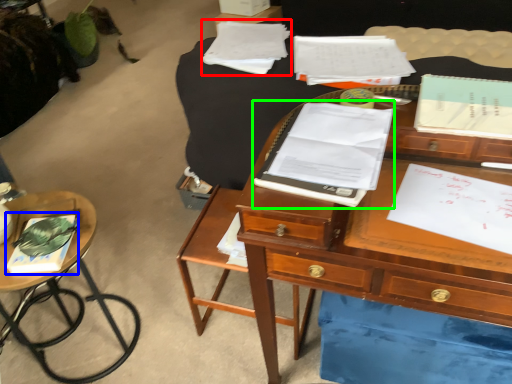
Question: Which is farther away from notebook (highlighted by a red box)? book (highlighted by a blue box) or notebook (highlighted by a green box)?

Choices:
 (A) book
 (B) notebook

Answer: (A)